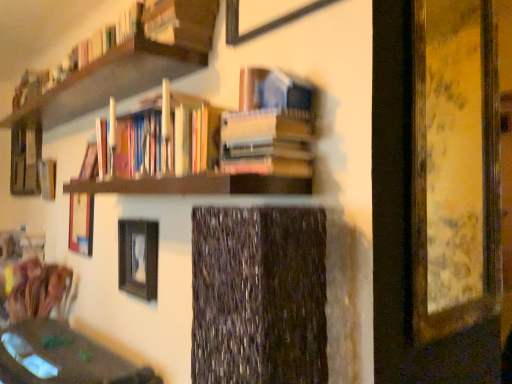
What do you see at coordinates (81, 223) in the screenshot? I see `wooden picture frame at center, the 1th picture frame when ordered from back to front` at bounding box center [81, 223].

Image resolution: width=512 pixels, height=384 pixels. What do you see at coordinates (62, 357) in the screenshot?
I see `matte brown table at lower left` at bounding box center [62, 357].

This screenshot has width=512, height=384. What do you see at coordinates (138, 258) in the screenshot?
I see `matte black picture frame at center, which is counted as the second picture frame, starting from the back` at bounding box center [138, 258].

Locate an element on the screen. hardcover book at center, marked as the 3th book in a top-to-bottom arrangement is located at coordinates (267, 143).

The height and width of the screenshot is (384, 512). Describe the element at coordinates (266, 22) in the screenshot. I see `wooden frame at upper center, which is the 2th picture frame in right-to-left order` at that location.

What is the approximate height of hardcover books at center, which is the second book in top-to-bottom order?

hardcover books at center, which is the second book in top-to-bottom order, is 10.72 inches in height.

At what (x,y) coordinates should I click in order to perform the action: click on wooden picture frame at center, which ranks as the first picture frame in left-to-right order. Please return your answer as a coordinate pair (x, y). Looking at the image, I should click on (81, 223).

In the image, is wooden bookshelf at left positioned in front of or behind wooden swivel chair at lower left?

wooden bookshelf at left is positioned farther from the viewer than wooden swivel chair at lower left.

Looking at their sizes, would you say wooden bookshelf at left is wider or thinner than wooden swivel chair at lower left?

Considering their sizes, wooden bookshelf at left looks slimmer than wooden swivel chair at lower left.

Is wooden bookshelf at left next to wooden swivel chair at lower left and touching it?

wooden bookshelf at left and wooden swivel chair at lower left are not in contact.

Is wooden bookshelf at left smaller than wooden swivel chair at lower left?

Yes.

From the image's perspective, does hardcover book at center, which appears as the first book when ordered from the bottom, appear higher than wooden bookshelf at upper left, which is the 3th book in bottom-to-top order?

No, from the image's perspective, hardcover book at center, which appears as the first book when ordered from the bottom, is not over wooden bookshelf at upper left, which is the 3th book in bottom-to-top order.

Can you confirm if hardcover book at center, marked as the 3th book in a top-to-bottom arrangement, is positioned to the left of wooden bookshelf at upper left, which is the 3th book in bottom-to-top order?

In fact, hardcover book at center, marked as the 3th book in a top-to-bottom arrangement, is to the right of wooden bookshelf at upper left, which is the 3th book in bottom-to-top order.

Is hardcover book at center, which appears as the first book when ordered from the bottom, wider than wooden bookshelf at upper left, which ranks as the 1th book in top-to-bottom order?

Indeed, hardcover book at center, which appears as the first book when ordered from the bottom, has a greater width compared to wooden bookshelf at upper left, which ranks as the 1th book in top-to-bottom order.

Which object is further away from the camera, hardcover book at center, which appears as the first book when ordered from the bottom, or wooden bookshelf at upper left, which ranks as the 1th book in top-to-bottom order?

Positioned behind is wooden bookshelf at upper left, which ranks as the 1th book in top-to-bottom order.

Is the position of wooden frame at upper center, which ranks as the 4th picture frame in back-to-front order, more distant than that of matte black picture frame at center, positioned as the third picture frame in front-to-back order?

No, wooden frame at upper center, which ranks as the 4th picture frame in back-to-front order, is closer to the camera.

Looking at the image, does wooden frame at upper center, which ranks as the 4th picture frame in back-to-front order, seem bigger or smaller compared to matte black picture frame at center, positioned as the 2th picture frame in left-to-right order?

Clearly, wooden frame at upper center, which ranks as the 4th picture frame in back-to-front order, is smaller in size than matte black picture frame at center, positioned as the 2th picture frame in left-to-right order.

Considering the sizes of wooden frame at upper center, arranged as the first picture frame when viewed from the front, and matte black picture frame at center, positioned as the 2th picture frame in left-to-right order, in the image, is wooden frame at upper center, arranged as the first picture frame when viewed from the front, wider or thinner than matte black picture frame at center, positioned as the 2th picture frame in left-to-right order,?

Clearly, wooden frame at upper center, arranged as the first picture frame when viewed from the front, has less width compared to matte black picture frame at center, positioned as the 2th picture frame in left-to-right order.

Which picture frame is the 2nd one when counting from the front of the matte black picture frame at center, positioned as the 2th picture frame in left-to-right order? Please provide its 2D coordinates.

[(266, 22)]

Which object is further away from the camera taking this photo, wooden swivel chair at lower left or wooden bookshelf at upper left, which ranks as the 1th book in top-to-bottom order?

wooden swivel chair at lower left is more distant.

Which is more to the right, wooden swivel chair at lower left or wooden bookshelf at upper left, which is the 3th book in bottom-to-top order?

wooden bookshelf at upper left, which is the 3th book in bottom-to-top order, is more to the right.

From the image's perspective, is wooden swivel chair at lower left positioned above or below wooden bookshelf at upper left, which ranks as the 1th book in top-to-bottom order?

From the image's perspective, wooden swivel chair at lower left appears below wooden bookshelf at upper left, which ranks as the 1th book in top-to-bottom order.

Considering the sizes of objects wooden swivel chair at lower left and wooden bookshelf at upper left, which is the 3th book in bottom-to-top order, in the image provided, who is thinner, wooden swivel chair at lower left or wooden bookshelf at upper left, which is the 3th book in bottom-to-top order,?

Thinner between the two is wooden bookshelf at upper left, which is the 3th book in bottom-to-top order.

In the image, is wooden picture frame at center, which ranks as the first picture frame in left-to-right order, positioned in front of or behind matte brown table at lower left?

Clearly, wooden picture frame at center, which ranks as the first picture frame in left-to-right order, is behind matte brown table at lower left.

Does wooden picture frame at center, the 4th picture frame from the front, have a greater height compared to matte brown table at lower left?

No.

How different are the orientations of wooden picture frame at center, which ranks as the 4th picture frame in right-to-left order, and matte brown table at lower left in degrees?

The angle between the facing direction of wooden picture frame at center, which ranks as the 4th picture frame in right-to-left order, and the facing direction of matte brown table at lower left is 1.15 degrees.

Measure the distance from wooden picture frame at center, the 4th picture frame from the front, to matte brown table at lower left.

23.86 inches.

Could you tell me if wooden swivel chair at lower left is turned towards wooden picture frame at right, arranged as the fourth picture frame when viewed from the left?

No, wooden swivel chair at lower left does not turn towards wooden picture frame at right, arranged as the fourth picture frame when viewed from the left.

From a real-world perspective, which object stands above the other?

In real-world perspective, wooden picture frame at right, marked as the first picture frame in a right-to-left arrangement, is above.

Which is in front, point (27, 310) or point (431, 58)?

The point (431, 58) is closer to the camera.

From the image's perspective, would you say wooden picture frame at right, arranged as the fourth picture frame when viewed from the left, is shown under wooden bookshelf at left?

Indeed, from the image's perspective, wooden picture frame at right, arranged as the fourth picture frame when viewed from the left, is shown beneath wooden bookshelf at left.

Based on the photo, how many degrees apart are the facing directions of wooden picture frame at right, the 2th picture frame when ordered from front to back, and wooden bookshelf at left?

The facing directions of wooden picture frame at right, the 2th picture frame when ordered from front to back, and wooden bookshelf at left are 89.5 degrees apart.

Which object is closer to the camera taking this photo, wooden picture frame at right, the 2th picture frame when ordered from front to back, or wooden bookshelf at left?

wooden picture frame at right, the 2th picture frame when ordered from front to back.

Find the location of a particular element. The image size is (512, 384). shelf to the left of wooden swivel chair at lower left is located at coordinates (25, 159).

Find the location of a particular element. This screenshot has width=512, height=384. book that is the 2nd object located below the wooden bookshelf at upper left, which is the 3th book in bottom-to-top order (from the image's perspective) is located at coordinates (267, 143).

Consider the image. Looking at the image, which one is located closer to matte brown table at lower left, wooden frame at upper center, marked as the third picture frame in a left-to-right arrangement, or wooden bookshelf at upper left, which is the 3th book in bottom-to-top order?

Based on the image, wooden bookshelf at upper left, which is the 3th book in bottom-to-top order, appears to be nearer to matte brown table at lower left.

Looking at the image, which one is located further to matte brown table at lower left, wooden bookshelf at left or wooden swivel chair at lower left?

wooden bookshelf at left.

From the image, which object appears to be nearer to matte brown table at lower left, wooden picture frame at center, which ranks as the 4th picture frame in right-to-left order, or matte black picture frame at center, arranged as the third picture frame when viewed from the right?

The object closer to matte brown table at lower left is matte black picture frame at center, arranged as the third picture frame when viewed from the right.

Which object lies further to the anchor point wooden bookshelf at left, wooden picture frame at right, which ranks as the 3th picture frame in back-to-front order, or hardcover book at center, marked as the 3th book in a top-to-bottom arrangement?

wooden picture frame at right, which ranks as the 3th picture frame in back-to-front order, lies further to wooden bookshelf at left than the other object.

Estimate the real-world distances between objects in this image. Which object is further from wooden frame at upper center, arranged as the first picture frame when viewed from the front, hardcover book at center, which appears as the first book when ordered from the bottom, or matte brown table at lower left?

The object further to wooden frame at upper center, arranged as the first picture frame when viewed from the front, is matte brown table at lower left.

When comparing their distances from wooden picture frame at center, the 4th picture frame from the front, does wooden bookshelf at left or matte black picture frame at center, arranged as the third picture frame when viewed from the right, seem closer?

The object closer to wooden picture frame at center, the 4th picture frame from the front, is matte black picture frame at center, arranged as the third picture frame when viewed from the right.

Which object lies nearer to the anchor point hardcover books at center, positioned as the second book in bottom-to-top order, wooden bookshelf at left or wooden picture frame at right, marked as the first picture frame in a right-to-left arrangement?

wooden picture frame at right, marked as the first picture frame in a right-to-left arrangement, is positioned closer to the anchor hardcover books at center, positioned as the second book in bottom-to-top order.

Considering their positions, is hardcover book at center, which appears as the first book when ordered from the bottom, positioned further to wooden frame at upper center, marked as the third picture frame in a left-to-right arrangement, than matte black picture frame at center, which is counted as the second picture frame, starting from the back?

Based on the image, matte black picture frame at center, which is counted as the second picture frame, starting from the back, appears to be further to wooden frame at upper center, marked as the third picture frame in a left-to-right arrangement.

Where is `swivel chair situated between wooden bookshelf at left and wooden picture frame at right, marked as the first picture frame in a right-to-left arrangement, from left to right`? swivel chair situated between wooden bookshelf at left and wooden picture frame at right, marked as the first picture frame in a right-to-left arrangement, from left to right is located at coordinates (37, 289).

I want to click on round table between wooden swivel chair at lower left and wooden picture frame at right, which ranks as the 3th picture frame in back-to-front order, from left to right, so click(62, 357).

The image size is (512, 384). Find the location of `swivel chair located between matte brown table at lower left and wooden bookshelf at left in the depth direction`. swivel chair located between matte brown table at lower left and wooden bookshelf at left in the depth direction is located at coordinates (37, 289).

The height and width of the screenshot is (384, 512). I want to click on picture frame located between hardcover books at center, positioned as the second book in bottom-to-top order, and wooden picture frame at right, marked as the first picture frame in a right-to-left arrangement, in the left-right direction, so click(266, 22).